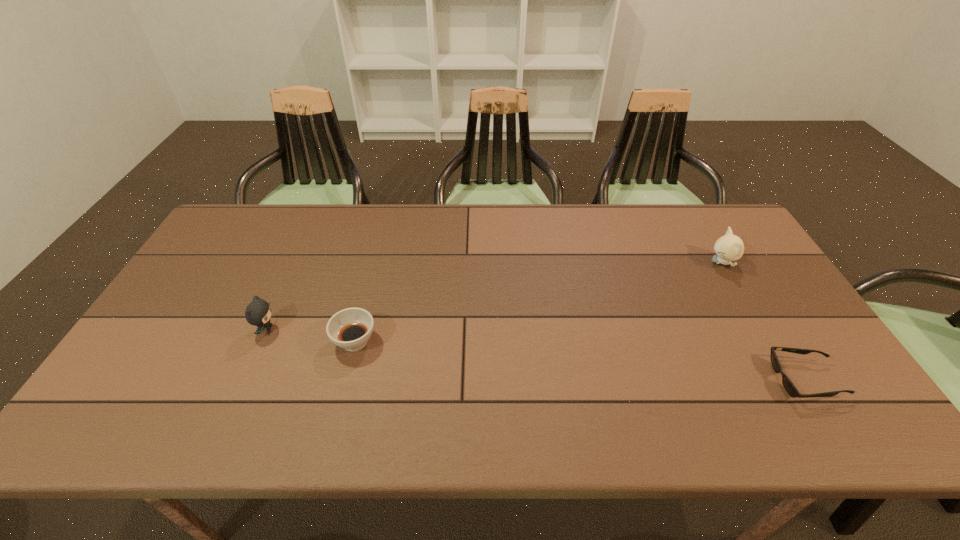
The image size is (960, 540). In the image, there is a desktop. Find the location of `free space at the near edge`. free space at the near edge is located at coordinates (511, 415).

In the image, there is a desktop. Identify the location of free space at the left edge. This screenshot has height=540, width=960. (141, 348).

Locate an element on the screen. free space at the right edge of the desktop is located at coordinates (804, 399).

This screenshot has height=540, width=960. In order to click on free space at the far left corner in this screenshot , I will do `click(226, 245)`.

This screenshot has height=540, width=960. In the image, there is a desktop. Find the location of `free space at the far right corner`. free space at the far right corner is located at coordinates (716, 210).

This screenshot has width=960, height=540. Find the location of `free space that is in between the leftmost object and the soup bowl`. free space that is in between the leftmost object and the soup bowl is located at coordinates (311, 335).

Locate an element on the screen. free space that is in between the soup bowl and the left kitten is located at coordinates (311, 335).

Locate an element on the screen. The image size is (960, 540). free space between the nearer kitten and the farthest object is located at coordinates (494, 296).

The height and width of the screenshot is (540, 960). In order to click on vacant area that lies between the sunglasses and the third object from right to left in this screenshot , I will do `click(580, 361)`.

What are the coordinates of `vacant space that is in between the leftmost object and the right kitten` in the screenshot? It's located at (494, 296).